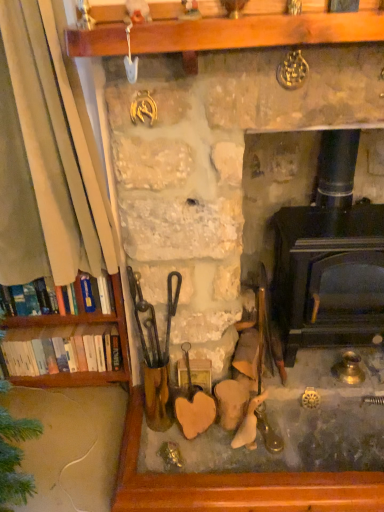
Question: Is hardcover books at left, the second book ordered from the bottom, behind black cast iron wood burning stove at center?

Choices:
 (A) yes
 (B) no

Answer: (A)

Question: Is hardcover books at left, placed as the 1th book when sorted from top to bottom, far from black cast iron wood burning stove at center?

Choices:
 (A) no
 (B) yes

Answer: (A)

Question: Is hardcover books at left, which is the 2th book from back to front, wider than black cast iron wood burning stove at center?

Choices:
 (A) yes
 (B) no

Answer: (B)

Question: Is black cast iron wood burning stove at center surrounded by hardcover books at left, the second book ordered from the bottom?

Choices:
 (A) yes
 (B) no

Answer: (B)

Question: Does hardcover books at left, the second book ordered from the bottom, turn towards black cast iron wood burning stove at center?

Choices:
 (A) yes
 (B) no

Answer: (B)

Question: Is hardcover books at left, which is the 2th book from back to front, at the right side of black cast iron wood burning stove at center?

Choices:
 (A) no
 (B) yes

Answer: (A)

Question: Does white paperbacks at left, the 1th book from the bottom, have a larger size compared to hardcover books at left, placed as the 1th book when sorted from top to bottom?

Choices:
 (A) yes
 (B) no

Answer: (A)

Question: Would you say hardcover books at left, arranged as the 1th book when viewed from the front, is part of white paperbacks at left, positioned as the second book in front-to-back order,'s contents?

Choices:
 (A) no
 (B) yes

Answer: (A)

Question: Can you confirm if white paperbacks at left, the 1th book from the bottom, is shorter than hardcover books at left, arranged as the 1th book when viewed from the front?

Choices:
 (A) yes
 (B) no

Answer: (B)

Question: Can you confirm if white paperbacks at left, positioned as the second book in front-to-back order, is positioned to the left of hardcover books at left, the second book ordered from the bottom?

Choices:
 (A) yes
 (B) no

Answer: (B)

Question: Is white paperbacks at left, the 1th book from the bottom, facing towards hardcover books at left, which is the 2th book from back to front?

Choices:
 (A) no
 (B) yes

Answer: (A)

Question: Can you confirm if white paperbacks at left, positioned as the second book in front-to-back order, is wider than hardcover books at left, placed as the 1th book when sorted from top to bottom?

Choices:
 (A) no
 (B) yes

Answer: (B)

Question: Is stone fireplace at center shorter than white paperbacks at left, which is the first book from back to front?

Choices:
 (A) yes
 (B) no

Answer: (B)